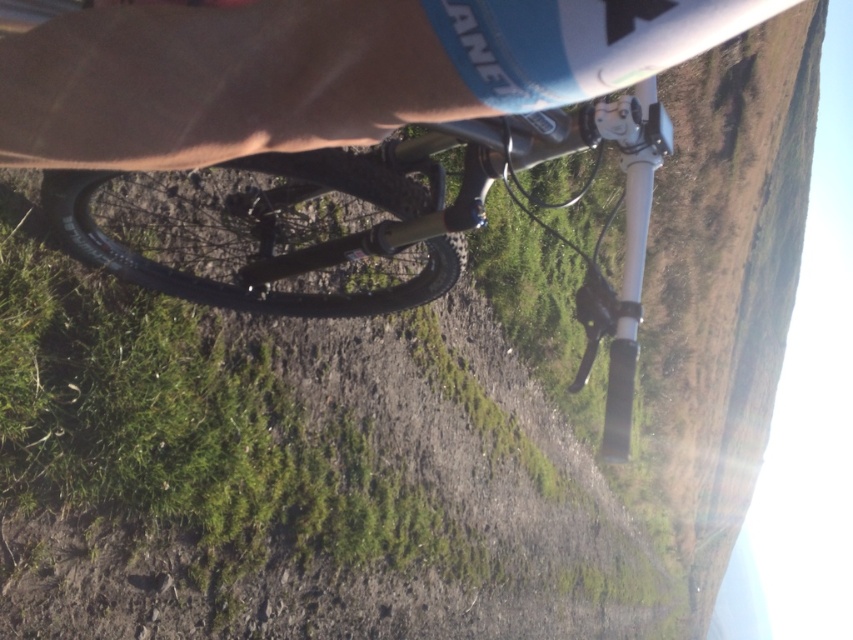
Does brown fabric at upper center appear on the left side of shiny metallic bicycle at center?

No, brown fabric at upper center is not to the left of shiny metallic bicycle at center.

Is brown fabric at upper center closer to camera compared to shiny metallic bicycle at center?

Yes, brown fabric at upper center is in front of shiny metallic bicycle at center.

Does point (160, 141) come behind point (318, 262)?

No.

Find the location of `brown fabric at upper center`. brown fabric at upper center is located at coordinates (312, 72).